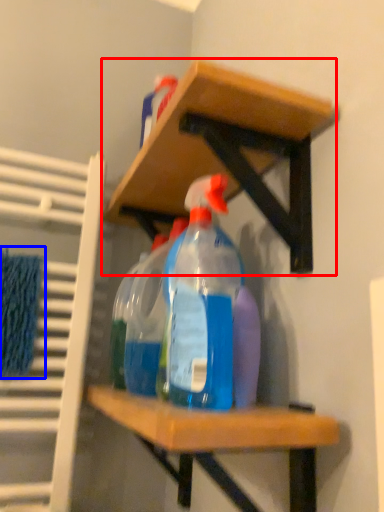
Question: Which of the following is the closest to the observer, shelf (highlighted by a red box) or bath towel (highlighted by a blue box)?

Choices:
 (A) shelf
 (B) bath towel

Answer: (A)